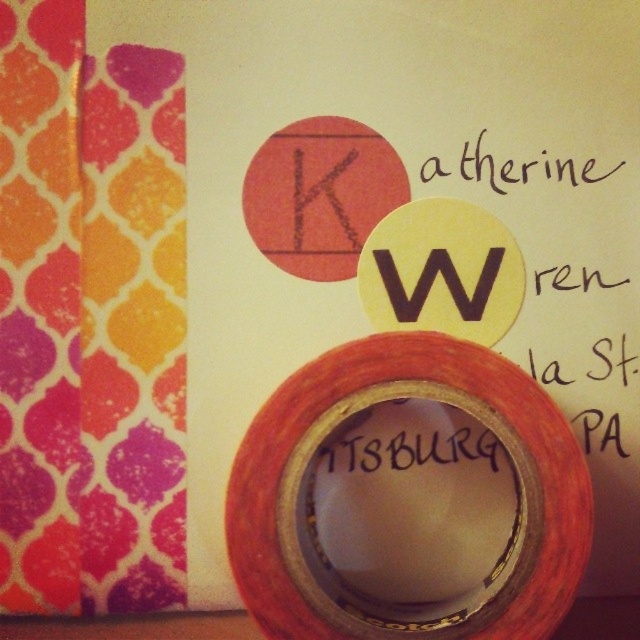
Question: Does matte orange tape at center appear on the right side of black paper at upper center?

Choices:
 (A) no
 (B) yes

Answer: (A)

Question: Among these objects, which one is farthest from the camera?

Choices:
 (A) black paper at upper center
 (B) matte orange tape at center

Answer: (A)

Question: Among these objects, which one is farthest from the camera?

Choices:
 (A) black paper at upper center
 (B) matte orange tape at center

Answer: (A)

Question: Is matte orange tape at center smaller than black paper at upper center?

Choices:
 (A) no
 (B) yes

Answer: (A)

Question: Does matte orange tape at center appear over black paper at upper center?

Choices:
 (A) no
 (B) yes

Answer: (A)